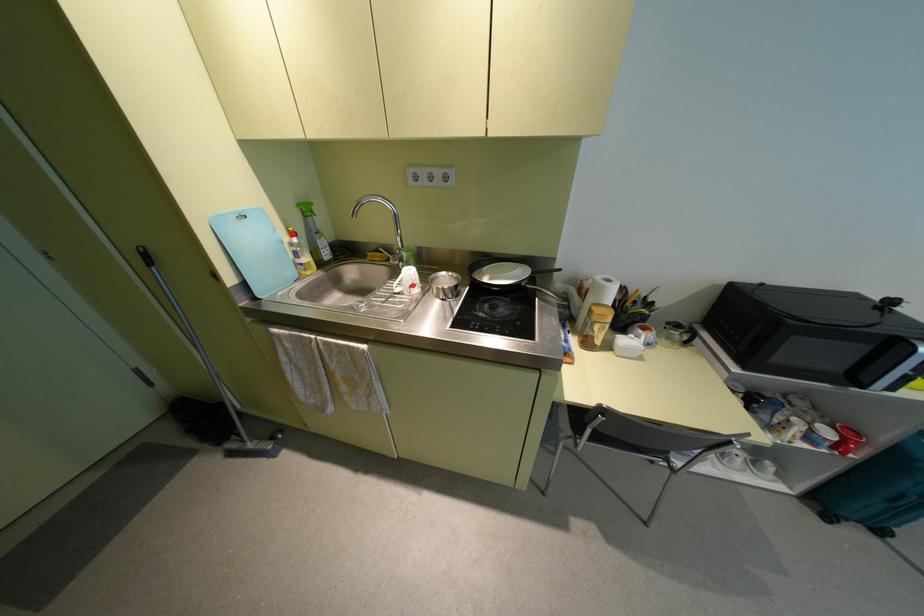
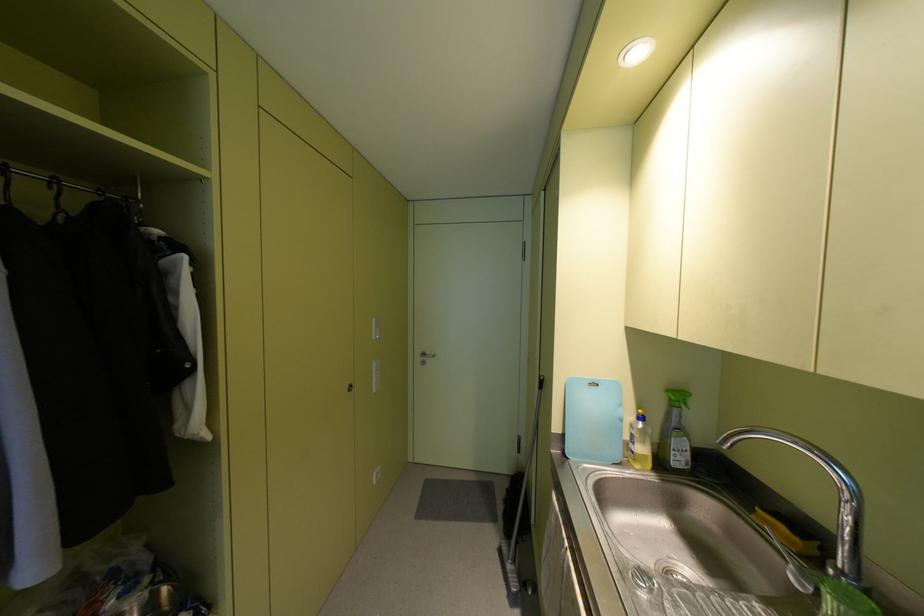
Question: I am providing you with two images of the same scene from different viewpoints. A red point is shown in image1. For the corresponding object point in image2, is it positioned nearer or farther from the camera?

Choices:
 (A) Nearer
 (B) Farther

Answer: (B)